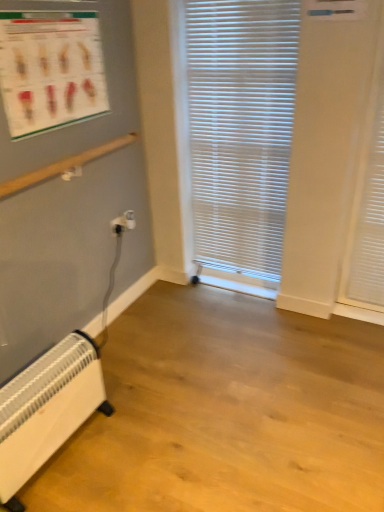
In the scene shown: Measure the distance between white matte shutter at right and camera.

white matte shutter at right is 6.15 feet from camera.

Describe the element at coordinates (123, 222) in the screenshot. I see `white plastic electrical outlet at lower left` at that location.

What do you see at coordinates (47, 408) in the screenshot? Image resolution: width=384 pixels, height=512 pixels. I see `white plastic heater at lower left` at bounding box center [47, 408].

What do you see at coordinates (240, 129) in the screenshot? I see `white plastic blinds at center` at bounding box center [240, 129].

Find the location of a particular element. white matte shutter at right is located at coordinates (370, 227).

Between point (193, 56) and point (68, 47), which one is positioned behind?

Point (193, 56)

Is white plastic blinds at center looking in the opposite direction of matte plastic poster at upper left?

No, white plastic blinds at center is not facing away from matte plastic poster at upper left.

Based on the photo, between white plastic blinds at center and matte plastic poster at upper left, which one has larger size?

white plastic blinds at center is bigger.

Can you tell me how much white plastic electrical outlet at lower left and white matte shutter at right differ in facing direction?

There is a 90.3-degree angle between the facing directions of white plastic electrical outlet at lower left and white matte shutter at right.

Is the surface of white plastic electrical outlet at lower left in direct contact with white matte shutter at right?

There is a gap between white plastic electrical outlet at lower left and white matte shutter at right.

Which is closer, (x=119, y=221) or (x=366, y=245)?

Point (x=119, y=221).

Consider the image. From a real-world perspective, which object rests below the other?

From a 3D spatial view, white plastic electrical outlet at lower left is below.

Between point (369, 256) and point (50, 379), which one is positioned in front?

The point (50, 379) is in front.

From a real-world perspective, does white matte shutter at right stand above white plastic heater at lower left?

Yes, from a real-world perspective, white matte shutter at right is on top of white plastic heater at lower left.

Between white matte shutter at right and white plastic heater at lower left, which one is positioned in front?

white plastic heater at lower left is closer to the camera.

In terms of width, does white plastic blinds at center look wider or thinner when compared to white plastic electrical outlet at lower left?

In the image, white plastic blinds at center appears to be wider than white plastic electrical outlet at lower left.

Is white plastic blinds at center bigger or smaller than white plastic electrical outlet at lower left?

In the image, white plastic blinds at center appears to be larger than white plastic electrical outlet at lower left.

Is the surface of white plastic blinds at center in direct contact with white plastic electrical outlet at lower left?

No, white plastic blinds at center is not next to white plastic electrical outlet at lower left.

Considering the positions of objects white plastic blinds at center and white plastic electrical outlet at lower left in the image provided, who is more to the left, white plastic blinds at center or white plastic electrical outlet at lower left?

Positioned to the left is white plastic electrical outlet at lower left.

Considering the sizes of objects matte plastic poster at upper left and white plastic electrical outlet at lower left in the image provided, who is shorter, matte plastic poster at upper left or white plastic electrical outlet at lower left?

white plastic electrical outlet at lower left is shorter.

From a real-world perspective, which is physically above, matte plastic poster at upper left or white plastic electrical outlet at lower left?

matte plastic poster at upper left, from a real-world perspective.

Image resolution: width=384 pixels, height=512 pixels. I want to click on bulletin board on the left of white plastic electrical outlet at lower left, so click(x=50, y=70).

Is matte plastic poster at upper left not near white plastic electrical outlet at lower left?

That's not correct — matte plastic poster at upper left is a little close to white plastic electrical outlet at lower left.

Is white plastic electrical outlet at lower left smaller than white plastic blinds at center?

Correct, white plastic electrical outlet at lower left occupies less space than white plastic blinds at center.

From a real-world perspective, which is physically above, white plastic electrical outlet at lower left or white plastic blinds at center?

In real-world perspective, white plastic blinds at center is above.

In the scene shown: Is there a large distance between white plastic electrical outlet at lower left and white plastic blinds at center?

No, white plastic electrical outlet at lower left is not far from white plastic blinds at center.

How far apart are white plastic electrical outlet at lower left and white plastic blinds at center?

white plastic electrical outlet at lower left is 29.09 inches away from white plastic blinds at center.

Who is shorter, matte plastic poster at upper left or white plastic blinds at center?

With less height is matte plastic poster at upper left.

Is matte plastic poster at upper left completely or partially outside of white plastic blinds at center?

That's correct, matte plastic poster at upper left is outside of white plastic blinds at center.

From a real-world perspective, is matte plastic poster at upper left on top of white plastic blinds at center?

Correct, in the physical world, matte plastic poster at upper left is higher than white plastic blinds at center.

In the image, there is a white plastic blinds at center. Identify the location of bulletin board above it (from the image's perspective). (50, 70).

In the image, there is a white matte shutter at right. Identify the location of electric outlet below it (from a real-world perspective). This screenshot has width=384, height=512. (123, 222).

Based on their spatial positions, is white plastic heater at lower left or matte plastic poster at upper left closer to white plastic electrical outlet at lower left?

matte plastic poster at upper left lies closer to white plastic electrical outlet at lower left than the other object.

Based on their spatial positions, is white plastic blinds at center or white plastic heater at lower left closer to matte plastic poster at upper left?

white plastic blinds at center is closer to matte plastic poster at upper left.

Which object lies further to the anchor point white plastic electrical outlet at lower left, white matte shutter at right or white plastic heater at lower left?

white matte shutter at right.

Looking at the image, which one is located further to white plastic electrical outlet at lower left, matte plastic poster at upper left or white plastic heater at lower left?

The object further to white plastic electrical outlet at lower left is white plastic heater at lower left.

Looking at the image, which one is located closer to white plastic blinds at center, white plastic heater at lower left or white plastic electrical outlet at lower left?

Based on the image, white plastic electrical outlet at lower left appears to be nearer to white plastic blinds at center.

From the picture: Looking at the image, which one is located closer to white plastic heater at lower left, matte plastic poster at upper left or white plastic blinds at center?

matte plastic poster at upper left lies closer to white plastic heater at lower left than the other object.

When comparing their distances from white plastic heater at lower left, does white plastic electrical outlet at lower left or white plastic blinds at center seem closer?

white plastic electrical outlet at lower left is closer to white plastic heater at lower left.

When comparing their distances from white matte shutter at right, does white plastic heater at lower left or white plastic blinds at center seem closer?

Based on the image, white plastic blinds at center appears to be nearer to white matte shutter at right.

Identify the location of electric outlet located between white plastic heater at lower left and white matte shutter at right in the left-right direction. (123, 222).

Identify the location of window blind between matte plastic poster at upper left and white plastic electrical outlet at lower left from front to back. Image resolution: width=384 pixels, height=512 pixels. click(240, 129).

Find the location of a particular element. electric outlet between white plastic blinds at center and white plastic heater at lower left from top to bottom is located at coordinates (123, 222).

Find the location of a particular element. window blind between white plastic electrical outlet at lower left and white matte shutter at right is located at coordinates (x=240, y=129).